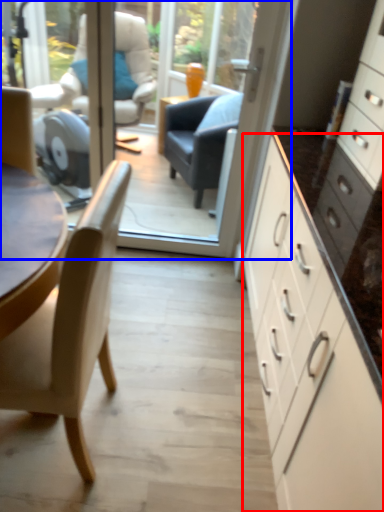
Question: Which of the following is the closest to the observer, cabinetry (highlighted by a red box) or glass door (highlighted by a blue box)?

Choices:
 (A) cabinetry
 (B) glass door

Answer: (A)